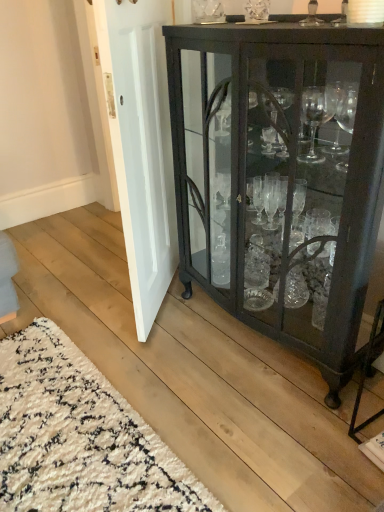
Identify the location of free space above white shaggy rug at lower left (from a real-world perspective). Image resolution: width=384 pixels, height=512 pixels. (59, 423).